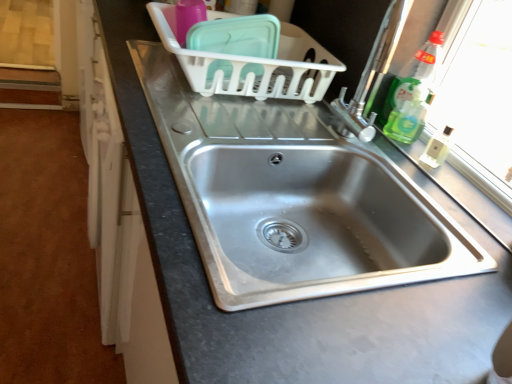
You are a GUI agent. You are given a task and a screenshot of the screen. Output one action in this format:
    pyautogui.click(x=<x>, y=<y>)
    Task: Click on the free space in front of clear plastic soap dispenser at right
    Image resolution: width=512 pixels, height=384 pixels.
    Given the screenshot: What is the action you would take?
    pyautogui.click(x=463, y=198)